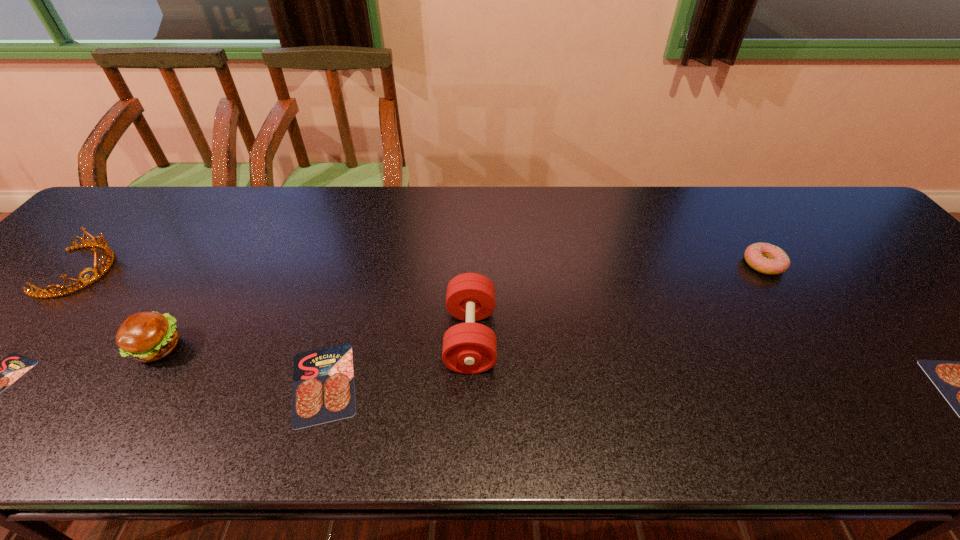
Locate an element on the screen. This screenshot has width=960, height=540. free region located on the front of the doughnut is located at coordinates (785, 299).

Where is `vacant space located on the right of the fifth object from right to left`? The width and height of the screenshot is (960, 540). vacant space located on the right of the fifth object from right to left is located at coordinates (243, 348).

What are the coordinates of `vacant space located on the back of the tallest object` in the screenshot? It's located at (472, 266).

Where is `salami located at the near edge`? salami located at the near edge is located at coordinates (323, 380).

The height and width of the screenshot is (540, 960). In order to click on hamburger located at the near edge in this screenshot , I will do `click(145, 336)`.

Find the location of a particular element. The width and height of the screenshot is (960, 540). dumbbell that is at the near edge is located at coordinates (469, 348).

This screenshot has height=540, width=960. Find the location of `object positioned at the left edge`. object positioned at the left edge is located at coordinates (109, 255).

Locate an element on the screen. This screenshot has width=960, height=540. free region at the far edge of the desktop is located at coordinates (590, 197).

Locate an element on the screen. Image resolution: width=960 pixels, height=540 pixels. vacant area at the near edge of the desktop is located at coordinates (173, 381).

This screenshot has height=540, width=960. In the image, there is a desktop. What are the coordinates of `free space at the right edge` in the screenshot? It's located at (838, 236).